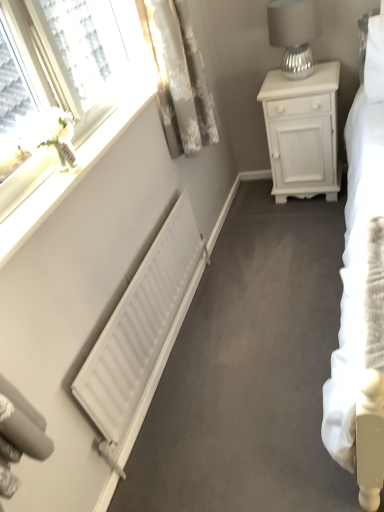
Identify the location of vacant space that's between white matte nightstand at upper right and white matte radiator at lower left. (249, 274).